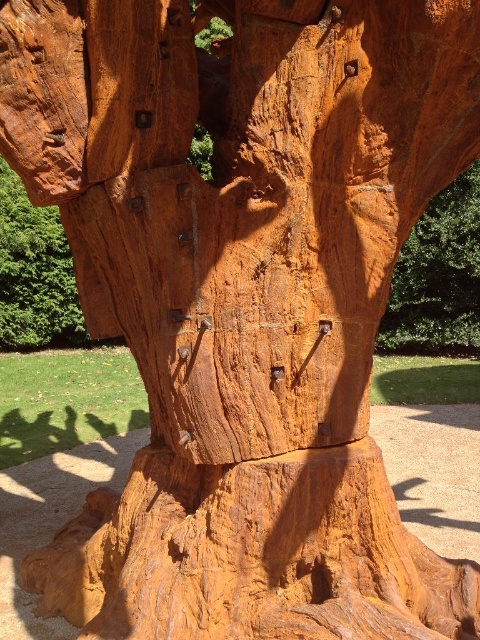
You are an art installer who needs to secure a heavy light fixture. You have two options on the sculpture, the smooth orange wood at upper right and the rustic wood carving at upper left. Based on their positions, which location would provide a more stable base for the fixture?

The smooth orange wood at upper right is positioned under rustic wood carving at upper left, so the rustic wood carving at upper left would provide a more stable base as it is above and likely more structurally supported.

You are an art curator examining the sculpture. You need to place a small plaque next to the smooth orange wood at upper right and the rustic wood carving at upper left. Which object should you place the plaque closer to if you want it to be on the right side of the sculpture?

The smooth orange wood at upper right is to the right of rustic wood carving at upper left, so placing the plaque closer to the smooth orange wood at upper right will position it on the right side of the sculpture.

You are an art restorer examining the sculpture. You notice two areas of concern labeled as smooth orange wood at upper right and rustic wood carving at upper left. Which area should you address first if you want to start with the part nearest to you?

The smooth orange wood at upper right is closer to the viewer than the rustic wood carving at upper left, so you should address the smooth orange wood at upper right first.